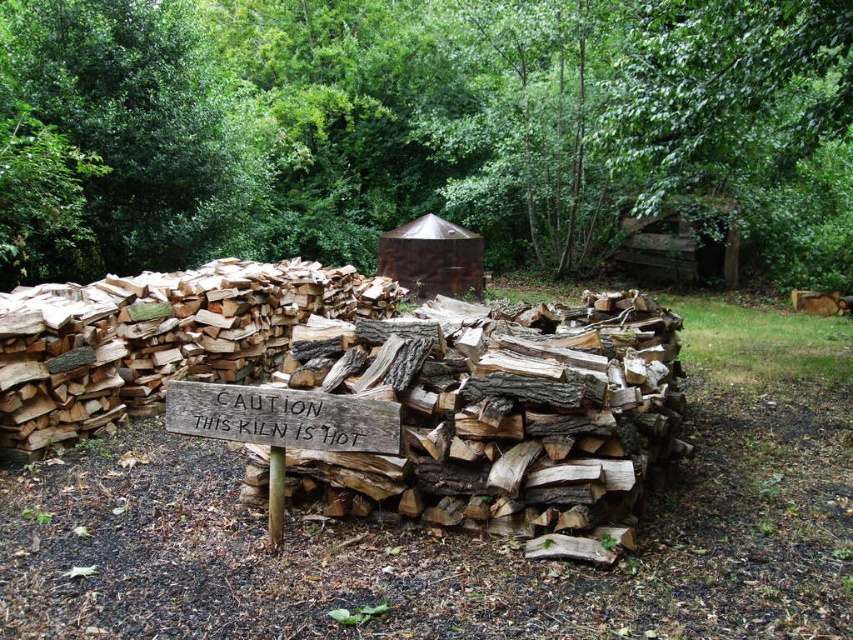
You are standing in the backyard and want to place a new wooden bench between the green leafy tree at upper center and the weathered wood sign at center. Based on their positions, which object should the bench be closer to?

The bench should be placed closer to the weathered wood sign at center because the green leafy tree at upper center is further away from the viewer than the sign, meaning the sign is closer to the bench location.

You are standing in the rustic outdoor setting described. You need to determine which object is taller between the green leafy tree at upper center and the weathered wood sign at center. Which one is taller?

The green leafy tree at upper center is taller than the weathered wood sign at center according to the description provided.

You are standing in the rustic outdoor setting and want to place a small garden gnome between the green leafy tree at upper center and the weathered wood sign at center. Based on their widths, which object should the gnome be closer to?

The green leafy tree at upper center might be wider than the weathered wood sign at center, so the gnome should be placed closer to the weathered wood sign at center to ensure it is visible between them.